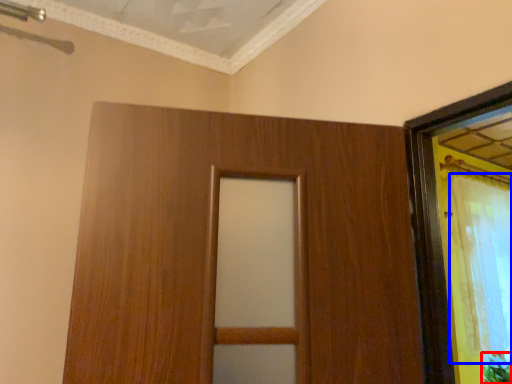
Question: Which object appears closest to the camera in this image, plant (highlighted by a red box) or curtain (highlighted by a blue box)?

Choices:
 (A) plant
 (B) curtain

Answer: (B)